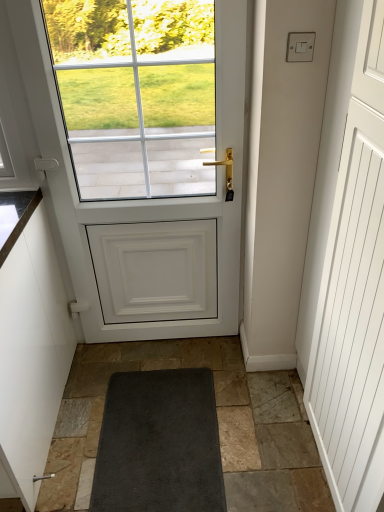
Question: Choose the correct answer: Is white plastic switch at upper right inside white matte door at center or outside it?

Choices:
 (A) inside
 (B) outside

Answer: (B)

Question: Looking at their shapes, would you say white plastic switch at upper right is wider or thinner than white matte door at center?

Choices:
 (A) wide
 (B) thin

Answer: (B)

Question: Estimate the real-world distances between objects in this image. Which object is closer to the white matte cabinet at left?

Choices:
 (A) silver metallic door handle at lower left
 (B) white matte door at center
 (C) white plastic switch at upper right
 (D) white matte screen door at right

Answer: (A)

Question: Estimate the real-world distances between objects in this image. Which object is closer to the white matte door at center?

Choices:
 (A) silver metallic door handle at lower left
 (B) white matte screen door at right
 (C) white matte cabinet at left
 (D) white plastic switch at upper right

Answer: (C)